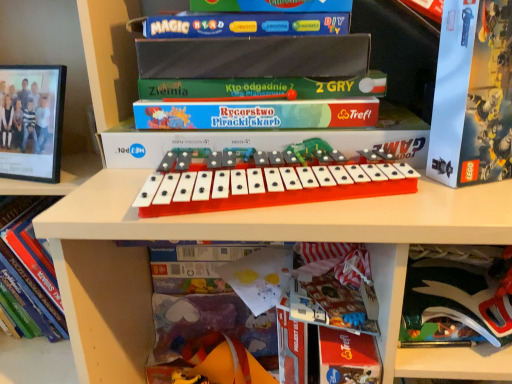
Question: Is matte black scissors at lower right, the 3th paperback book viewed from the top, turned away from red paper at lower center, the 1th paperback book from the bottom?

Choices:
 (A) yes
 (B) no

Answer: (B)

Question: Considering the relative positions of matte black scissors at lower right, which is counted as the second paperback book, starting from the bottom, and red paper at lower center, which appears as the 4th paperback book when viewed from the top, in the image provided, is matte black scissors at lower right, which is counted as the second paperback book, starting from the bottom, to the left of red paper at lower center, which appears as the 4th paperback book when viewed from the top, from the viewer's perspective?

Choices:
 (A) yes
 (B) no

Answer: (B)

Question: From the image's perspective, does matte black scissors at lower right, the 3th paperback book viewed from the top, appear lower than red paper at lower center, which appears as the 4th paperback book when viewed from the top?

Choices:
 (A) no
 (B) yes

Answer: (A)

Question: From a real-world perspective, is matte black scissors at lower right, which is counted as the second paperback book, starting from the bottom, on red paper at lower center, which appears as the 4th paperback book when viewed from the top?

Choices:
 (A) yes
 (B) no

Answer: (A)

Question: Can you confirm if matte black scissors at lower right, the 3th paperback book viewed from the top, is shorter than red paper at lower center, the 1th paperback book from the bottom?

Choices:
 (A) no
 (B) yes

Answer: (B)

Question: Considering their positions, is matte paper book at lower center, the 2th book in the right-to-left sequence, located in front of or behind matte black scissors at lower right, the 3th paperback book viewed from the top?

Choices:
 (A) front
 (B) behind

Answer: (B)

Question: From the image's perspective, is matte paper book at lower center, the 2th book in the right-to-left sequence, located above or below matte black scissors at lower right, which is counted as the second paperback book, starting from the bottom?

Choices:
 (A) above
 (B) below

Answer: (B)

Question: In terms of width, does matte paper book at lower center, the 2th book in the right-to-left sequence, look wider or thinner when compared to matte black scissors at lower right, the 3th paperback book viewed from the top?

Choices:
 (A) wide
 (B) thin

Answer: (B)

Question: From a real-world perspective, is matte paper book at lower center, the 2th book in the right-to-left sequence, physically located above or below matte black scissors at lower right, which is counted as the second paperback book, starting from the bottom?

Choices:
 (A) above
 (B) below

Answer: (B)

Question: Would you say hardcover book at center, which appears as the first book when viewed from the right, is to the left or to the right of rubber duck at lower center in the picture?

Choices:
 (A) right
 (B) left

Answer: (A)

Question: In terms of height, does hardcover book at center, which appears as the first book when viewed from the right, look taller or shorter compared to rubber duck at lower center?

Choices:
 (A) tall
 (B) short

Answer: (A)

Question: From a real-world perspective, is hardcover book at center, which appears as the first book when viewed from the right, positioned above or below rubber duck at lower center?

Choices:
 (A) above
 (B) below

Answer: (A)

Question: From the image's perspective, is hardcover book at center, which is counted as the third book, starting from the left, above or below rubber duck at lower center?

Choices:
 (A) above
 (B) below

Answer: (A)

Question: Is red paper at lower center, which appears as the 4th paperback book when viewed from the top, spatially inside hardcover book at center, which appears as the first book when viewed from the right, or outside of it?

Choices:
 (A) inside
 (B) outside

Answer: (B)

Question: Would you say red paper at lower center, which appears as the 4th paperback book when viewed from the top, is to the left or to the right of hardcover book at center, which appears as the first book when viewed from the right, in the picture?

Choices:
 (A) right
 (B) left

Answer: (A)